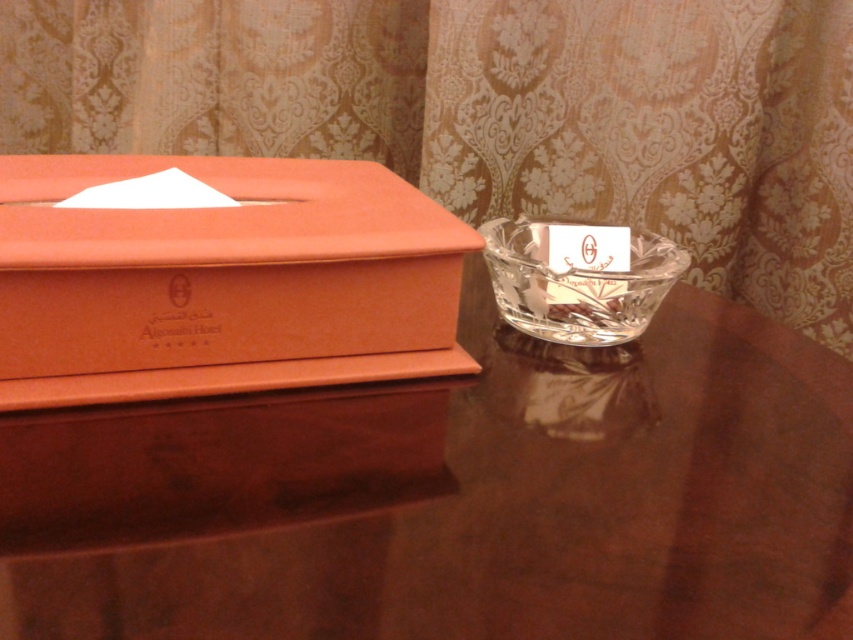
Question: Which point is farther to the camera?

Choices:
 (A) orange cardboard tissue box at left
 (B) brown glossy table at center
 (C) matte gold curtain at upper center

Answer: (C)

Question: Does matte gold curtain at upper center appear on the left side of clear crystal bowl at center?

Choices:
 (A) yes
 (B) no

Answer: (A)

Question: Which object appears closest to the camera in this image?

Choices:
 (A) brown glossy table at center
 (B) orange cardboard tissue box at left
 (C) matte gold curtain at upper center
 (D) clear crystal bowl at center

Answer: (A)

Question: Among these objects, which one is nearest to the camera?

Choices:
 (A) matte gold curtain at upper center
 (B) brown glossy table at center

Answer: (B)

Question: Is brown glossy table at center further to camera compared to orange cardboard tissue box at left?

Choices:
 (A) yes
 (B) no

Answer: (B)

Question: Does orange cardboard tissue box at left come in front of clear crystal bowl at center?

Choices:
 (A) no
 (B) yes

Answer: (B)